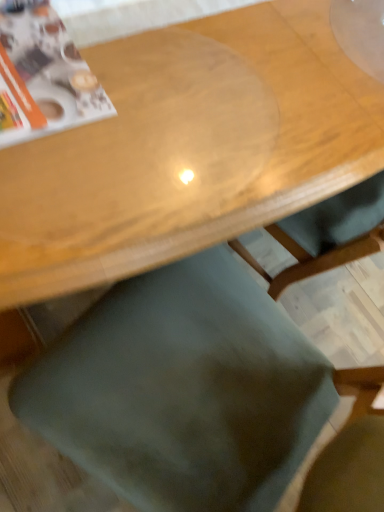
Question: Considering the relative sizes of transparent plastic table at upper center and green fabric chair at lower center in the image provided, is transparent plastic table at upper center bigger than green fabric chair at lower center?

Choices:
 (A) yes
 (B) no

Answer: (A)

Question: Can you confirm if transparent plastic table at upper center is shorter than green fabric chair at lower center?

Choices:
 (A) yes
 (B) no

Answer: (A)

Question: Is transparent plastic table at upper center at the left side of green fabric chair at lower center?

Choices:
 (A) yes
 (B) no

Answer: (A)

Question: Can you confirm if transparent plastic table at upper center is taller than green fabric chair at lower center?

Choices:
 (A) yes
 (B) no

Answer: (B)

Question: From a real-world perspective, is transparent plastic table at upper center located higher than green fabric chair at lower center?

Choices:
 (A) no
 (B) yes

Answer: (A)

Question: Are transparent plastic table at upper center and green fabric chair at lower center located far from each other?

Choices:
 (A) no
 (B) yes

Answer: (A)

Question: From a real-world perspective, is matte paper magazine at upper left beneath green fabric chair at lower center?

Choices:
 (A) no
 (B) yes

Answer: (A)

Question: Is matte paper magazine at upper left facing away from green fabric chair at lower center?

Choices:
 (A) no
 (B) yes

Answer: (A)

Question: Considering the relative sizes of matte paper magazine at upper left and green fabric chair at lower center in the image provided, is matte paper magazine at upper left taller than green fabric chair at lower center?

Choices:
 (A) yes
 (B) no

Answer: (B)

Question: Does matte paper magazine at upper left have a lesser width compared to green fabric chair at lower center?

Choices:
 (A) yes
 (B) no

Answer: (A)

Question: Is matte paper magazine at upper left wider than green fabric chair at lower center?

Choices:
 (A) yes
 (B) no

Answer: (B)

Question: Would you say green fabric chair at lower center is part of matte paper magazine at upper left's contents?

Choices:
 (A) yes
 (B) no

Answer: (B)

Question: Is matte paper magazine at upper left closer to camera compared to transparent plastic table at upper center?

Choices:
 (A) yes
 (B) no

Answer: (B)